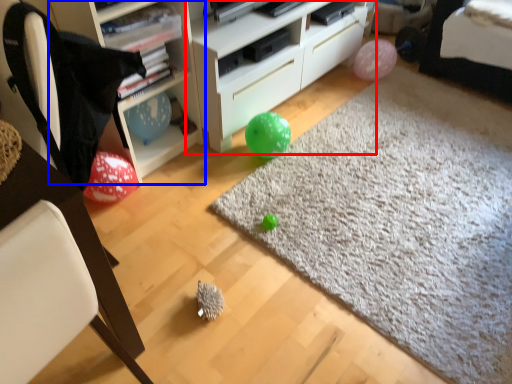
Question: Which object appears farthest to the camera in this image, cabinetry (highlighted by a red box) or shelf (highlighted by a blue box)?

Choices:
 (A) cabinetry
 (B) shelf

Answer: (A)